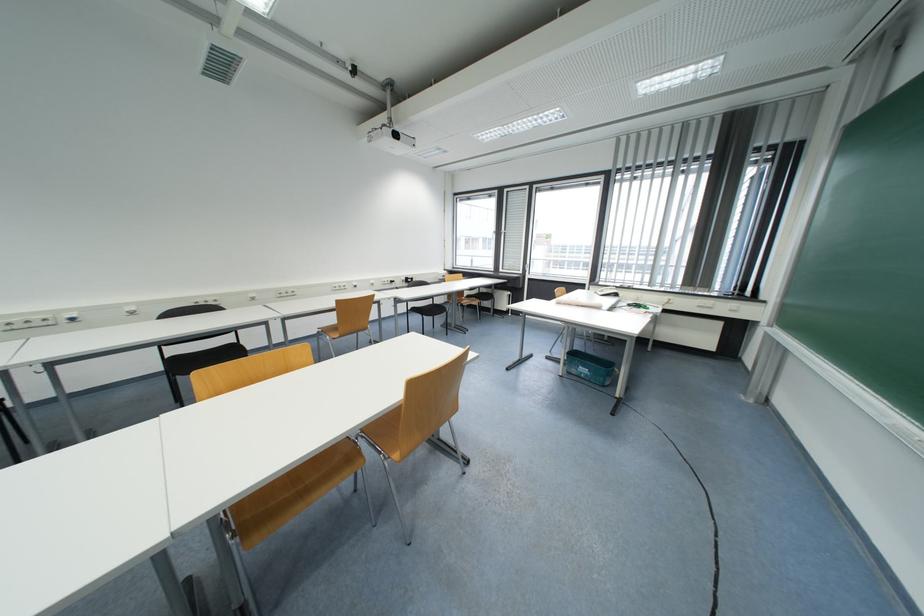
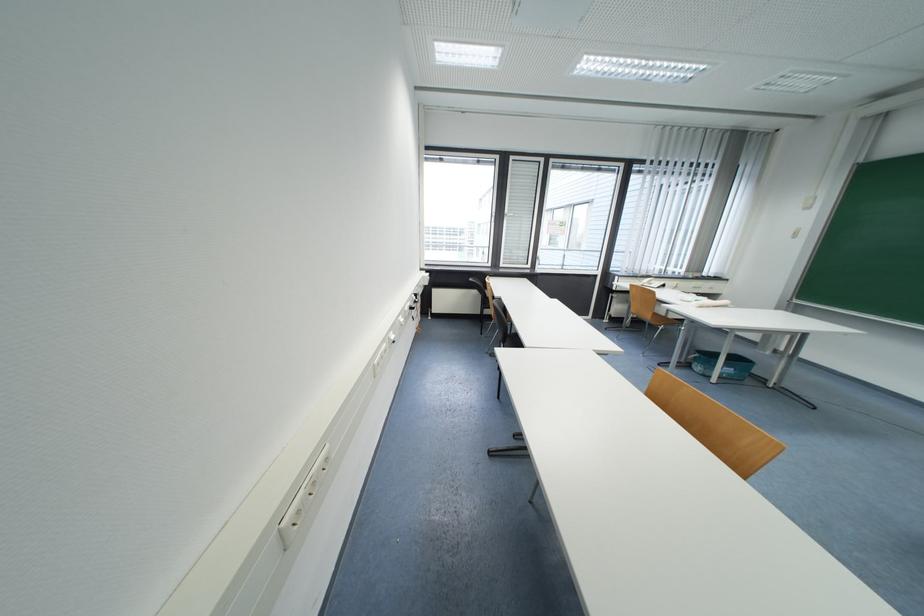
Find the pixel in the second image that matches the point at 590,377 in the first image.

(734, 377)